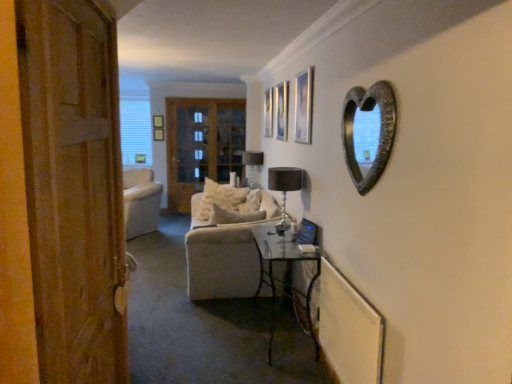
Question: Does clear glass door at center have a greater height compared to matte black lampshade at center, the second lamp viewed from the front?

Choices:
 (A) no
 (B) yes

Answer: (B)

Question: Is clear glass door at center not near matte black lampshade at center, the second lamp from the right?

Choices:
 (A) no
 (B) yes

Answer: (B)

Question: Can you confirm if clear glass door at center is positioned to the right of matte black lampshade at center, positioned as the 1th lamp in left-to-right order?

Choices:
 (A) yes
 (B) no

Answer: (B)

Question: From a real-world perspective, is clear glass door at center on top of matte black lampshade at center, the second lamp viewed from the front?

Choices:
 (A) no
 (B) yes

Answer: (B)

Question: Does clear glass door at center touch matte black lampshade at center, the first lamp in the back-to-front sequence?

Choices:
 (A) yes
 (B) no

Answer: (B)

Question: Considering the positions of metallic silver picture frame at upper center, which is the second picture frame from left to right, and white fabric couch at center in the image, is metallic silver picture frame at upper center, which is the second picture frame from left to right, wider or thinner than white fabric couch at center?

Choices:
 (A) thin
 (B) wide

Answer: (A)

Question: Based on their sizes in the image, would you say metallic silver picture frame at upper center, positioned as the 2th picture frame in right-to-left order, is bigger or smaller than white fabric couch at center?

Choices:
 (A) small
 (B) big

Answer: (A)

Question: From the image's perspective, relative to white fabric couch at center, is metallic silver picture frame at upper center, which is the second picture frame in front-to-back order, above or below?

Choices:
 (A) below
 (B) above

Answer: (B)

Question: Is metallic silver picture frame at upper center, the second picture frame viewed from the back, to the left or to the right of white fabric couch at center in the image?

Choices:
 (A) left
 (B) right

Answer: (B)

Question: Is clear glass door at center inside or outside of matte black lampshade at center, the second lamp viewed from the front?

Choices:
 (A) outside
 (B) inside

Answer: (A)

Question: From a real-world perspective, is clear glass door at center physically located above or below matte black lampshade at center, the first lamp in the back-to-front sequence?

Choices:
 (A) above
 (B) below

Answer: (A)

Question: In terms of height, does clear glass door at center look taller or shorter compared to matte black lampshade at center, the first lamp in the back-to-front sequence?

Choices:
 (A) tall
 (B) short

Answer: (A)

Question: From the image's perspective, is clear glass door at center positioned above or below matte black lampshade at center, the second lamp viewed from the front?

Choices:
 (A) above
 (B) below

Answer: (A)

Question: Considering the positions of metallic silver picture frame at upper center, positioned as the 2th picture frame in right-to-left order, and clear glass door at center in the image, is metallic silver picture frame at upper center, positioned as the 2th picture frame in right-to-left order, taller or shorter than clear glass door at center?

Choices:
 (A) tall
 (B) short

Answer: (B)

Question: Would you say metallic silver picture frame at upper center, which is the second picture frame from left to right, is inside or outside clear glass door at center?

Choices:
 (A) outside
 (B) inside

Answer: (A)